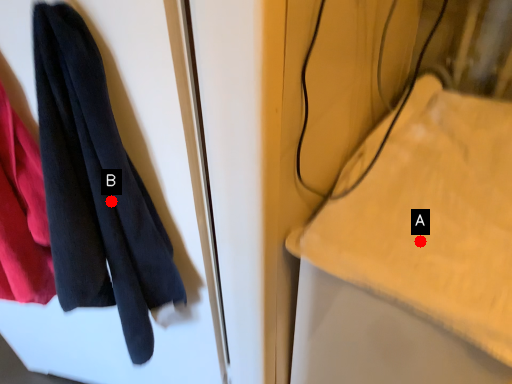
Question: Two points are circled on the image, labeled by A and B beside each circle. Which point is farther to the camera?

Choices:
 (A) A is further
 (B) B is further

Answer: (A)